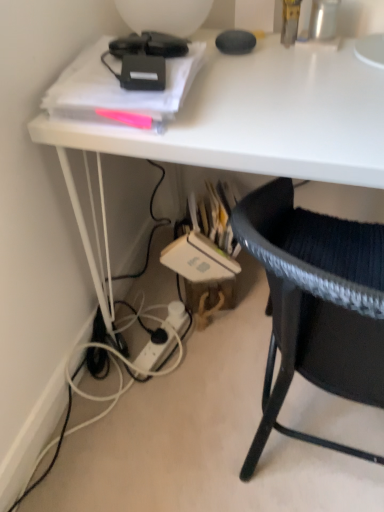
Measure the distance between point (148, 342) and camera.

The distance of point (148, 342) from camera is 4.20 feet.

What do you see at coordinates (315, 305) in the screenshot? I see `black woven chair at lower right` at bounding box center [315, 305].

You are a GUI agent. You are given a task and a screenshot of the screen. Output one action in this format:
    pyautogui.click(x=<x>, y=<y>)
    Task: Click on the white plastic power outlet at lower center
    This screenshot has width=384, height=512.
    Given the screenshot: What is the action you would take?
    pyautogui.click(x=154, y=352)

The image size is (384, 512). In the image, there is a black woven chair at lower right. In order to click on desk above it (from the image's perspective) in this screenshot , I will do click(252, 122).

Do you think black woven chair at lower right is within white glossy desk at upper center, or outside of it?

black woven chair at lower right lies within the bounds of white glossy desk at upper center.

Who is taller, black woven chair at lower right or white glossy desk at upper center?

With more height is white glossy desk at upper center.

Considering the positions of objects white plastic power outlet at lower center and black woven chair at lower right in the image provided, who is more to the right, white plastic power outlet at lower center or black woven chair at lower right?

Positioned to the right is black woven chair at lower right.

You are a GUI agent. You are given a task and a screenshot of the screen. Output one action in this format:
    pyautogui.click(x=<x>, y=<y>)
    Task: Click on the power outlet directly beneath the black woven chair at lower right (from a real-world perspective)
    The width and height of the screenshot is (384, 512).
    Given the screenshot: What is the action you would take?
    pyautogui.click(x=154, y=352)

Considering the sizes of objects white plastic power outlet at lower center and black woven chair at lower right in the image provided, who is thinner, white plastic power outlet at lower center or black woven chair at lower right?

white plastic power outlet at lower center.

Is white plastic power outlet at lower center inside or outside of black woven chair at lower right?

white plastic power outlet at lower center is spatially situated outside black woven chair at lower right.

From a real-world perspective, which is physically above, white glossy desk at upper center or black woven chair at lower right?

white glossy desk at upper center is physically above.

Considering the relative sizes of white glossy desk at upper center and black woven chair at lower right in the image provided, is white glossy desk at upper center thinner than black woven chair at lower right?

In fact, white glossy desk at upper center might be wider than black woven chair at lower right.

Is white glossy desk at upper center facing away from black woven chair at lower right?

That's right, white glossy desk at upper center is facing away from black woven chair at lower right.

Considering the positions of points (328, 153) and (259, 239), is point (328, 153) closer to camera compared to point (259, 239)?

No, it is not.

Would you consider white plastic power outlet at lower center to be distant from white glossy desk at upper center?

No, white plastic power outlet at lower center is not far from white glossy desk at upper center.

Which object is positioned more to the right, white plastic power outlet at lower center or white glossy desk at upper center?

From the viewer's perspective, white glossy desk at upper center appears more on the right side.

Which object is closer to the camera, white plastic power outlet at lower center or white glossy desk at upper center?

white glossy desk at upper center.

Is white plastic power outlet at lower center taller or shorter than white glossy desk at upper center?

In the image, white plastic power outlet at lower center appears to be shorter than white glossy desk at upper center.

Which object is wider, white glossy desk at upper center or white plastic power outlet at lower center?

With larger width is white glossy desk at upper center.

From a real-world perspective, between white glossy desk at upper center and white plastic power outlet at lower center, who is vertically higher?

white glossy desk at upper center.

Would you say white glossy desk at upper center is a long distance from white plastic power outlet at lower center?

white glossy desk at upper center is near white plastic power outlet at lower center, not far away.

Is black woven chair at lower right positioned with its back to white plastic power outlet at lower center?

No, black woven chair at lower right is not facing away from white plastic power outlet at lower center.

Is point (351, 388) positioned behind point (141, 354)?

No, (351, 388) is in front of (141, 354).

Is black woven chair at lower right not close to white plastic power outlet at lower center?

No, black woven chair at lower right is not far from white plastic power outlet at lower center.

Where is `desk on the left side of black woven chair at lower right`? This screenshot has height=512, width=384. desk on the left side of black woven chair at lower right is located at coordinates (252, 122).

Locate an element on the screen. power outlet below the black woven chair at lower right (from the image's perspective) is located at coordinates (154, 352).

Estimate the real-world distances between objects in this image. Which object is closer to white plastic power outlet at lower center, white glossy desk at upper center or black woven chair at lower right?

Among the two, black woven chair at lower right is located nearer to white plastic power outlet at lower center.

When comparing their distances from black woven chair at lower right, does white glossy desk at upper center or white plastic power outlet at lower center seem further?

white plastic power outlet at lower center is further to black woven chair at lower right.

Based on their spatial positions, is white plastic power outlet at lower center or black woven chair at lower right further from white glossy desk at upper center?

white plastic power outlet at lower center is positioned further to the anchor white glossy desk at upper center.

From the picture: Which object lies nearer to the anchor point black woven chair at lower right, white plastic power outlet at lower center or white glossy desk at upper center?

white glossy desk at upper center is positioned closer to the anchor black woven chair at lower right.

When comparing their distances from white plastic power outlet at lower center, does black woven chair at lower right or white glossy desk at upper center seem further?

white glossy desk at upper center lies further to white plastic power outlet at lower center than the other object.

Looking at the image, which one is located further to white glossy desk at upper center, black woven chair at lower right or white plastic power outlet at lower center?

Based on the image, white plastic power outlet at lower center appears to be further to white glossy desk at upper center.

This screenshot has height=512, width=384. Find the location of `desk between black woven chair at lower right and white plastic power outlet at lower center from front to back`. desk between black woven chair at lower right and white plastic power outlet at lower center from front to back is located at coordinates (252, 122).